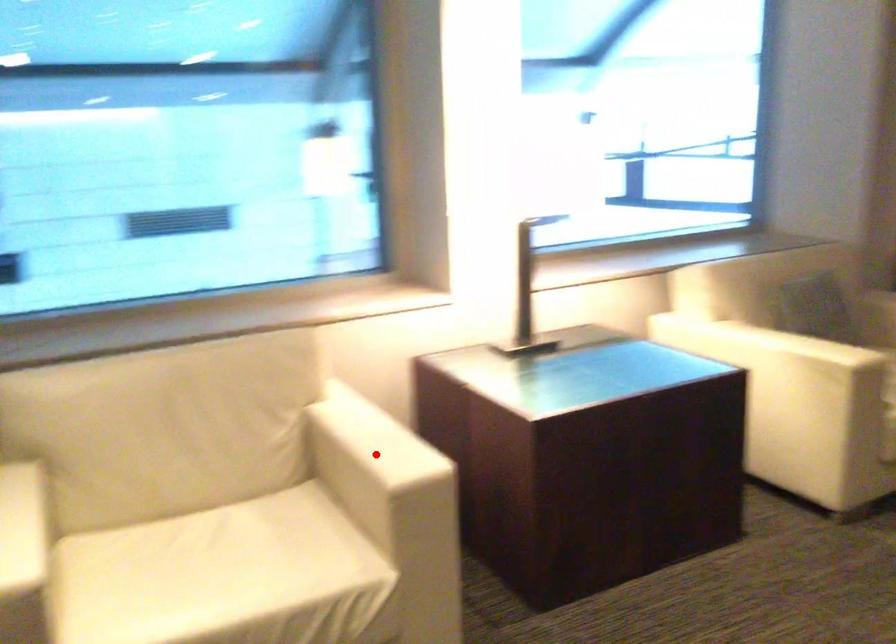
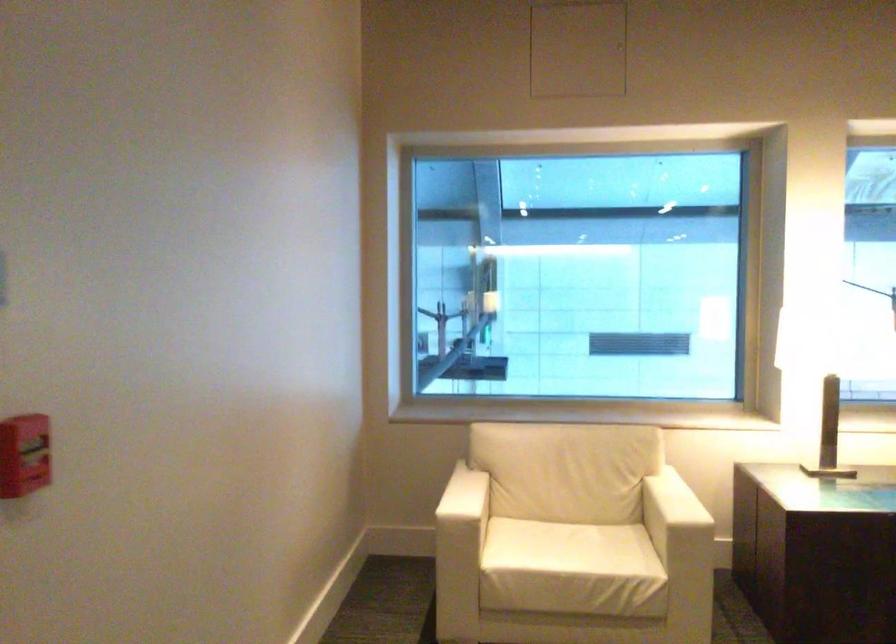
Question: A red point is marked in image1. In image2, is the corresponding 3D point closer to the camera or farther? Reply with the corresponding letter.

Choices:
 (A) The corresponding 3D point is closer.
 (B) The corresponding 3D point is farther.

Answer: (B)